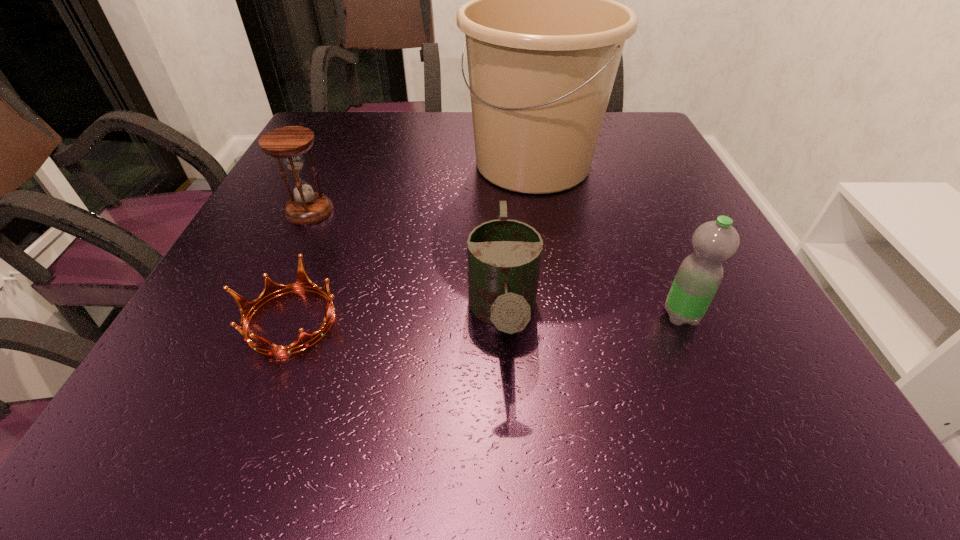
At what (x,y) coordinates should I click in order to perform the action: click on object present at the far edge. Please return your answer as a coordinate pair (x, y). Looking at the image, I should click on (544, 37).

Find the location of a particular element. This screenshot has height=540, width=960. object that is at the near edge is located at coordinates (504, 256).

At what (x,y) coordinates should I click in order to perform the action: click on hourglass that is positioned at the left edge. Please return your answer as a coordinate pair (x, y). This screenshot has height=540, width=960. Looking at the image, I should click on (290, 143).

You are a GUI agent. You are given a task and a screenshot of the screen. Output one action in this format:
    pyautogui.click(x=<x>, y=<y>)
    Task: Click on the crown located in the left edge section of the desktop
    
    Given the screenshot: What is the action you would take?
    pyautogui.click(x=272, y=289)

Where is `object that is at the right edge`? object that is at the right edge is located at coordinates pyautogui.click(x=700, y=274).

I want to click on vacant space at the far edge of the desktop, so click(x=416, y=112).

Where is `vacant space at the near edge of the desktop`? The height and width of the screenshot is (540, 960). vacant space at the near edge of the desktop is located at coordinates (604, 440).

In the image, there is a desktop. In order to click on vacant space at the left edge in this screenshot , I will do `click(280, 261)`.

Locate an element on the screen. vacant space at the right edge of the desktop is located at coordinates (635, 195).

Where is `free region at the near left corner`? free region at the near left corner is located at coordinates (190, 418).